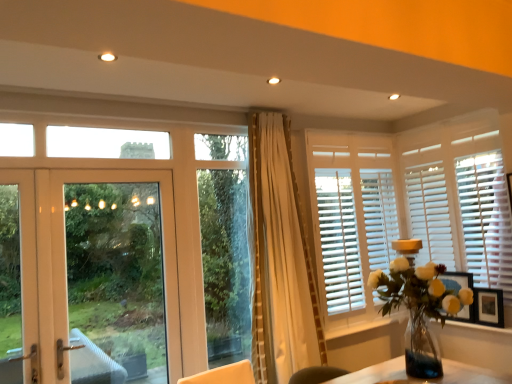
At what (x,y) coordinates should I click in order to perform the action: click on free spot above white textured curtain at center (from a real-world perspective). Please return your answer as a coordinate pair (x, y). The width and height of the screenshot is (512, 384). Looking at the image, I should click on (272, 100).